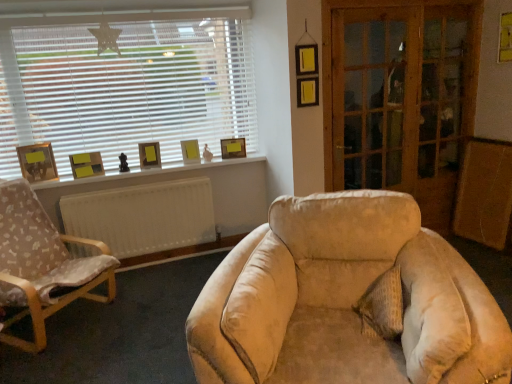
The width and height of the screenshot is (512, 384). What are the coordinates of `empty space that is ontop of white blinds at upper left (from a real-world perspective)` in the screenshot? It's located at (87, 2).